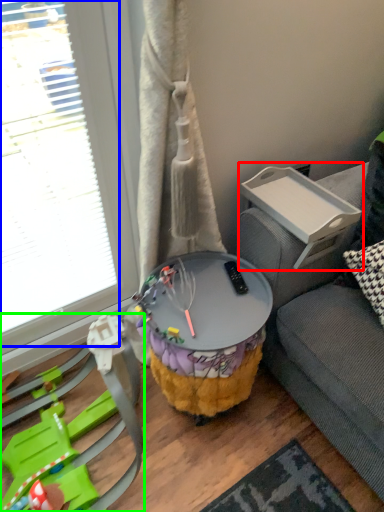
Question: Based on their relative distances, which object is nearer to table (highlighted by a red box)? Choose from glass door (highlighted by a blue box) and toy (highlighted by a green box).

Choices:
 (A) glass door
 (B) toy

Answer: (A)